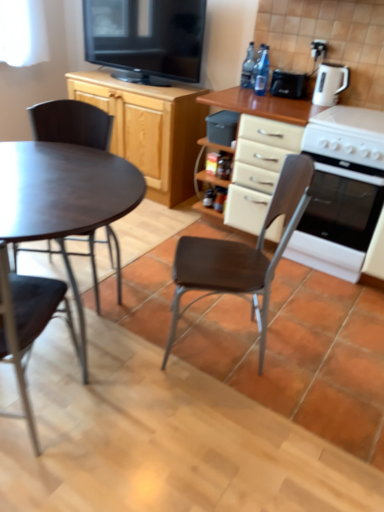
This screenshot has width=384, height=512. I want to click on free region under black glossy television at upper center (from a real-world perspective), so click(x=167, y=82).